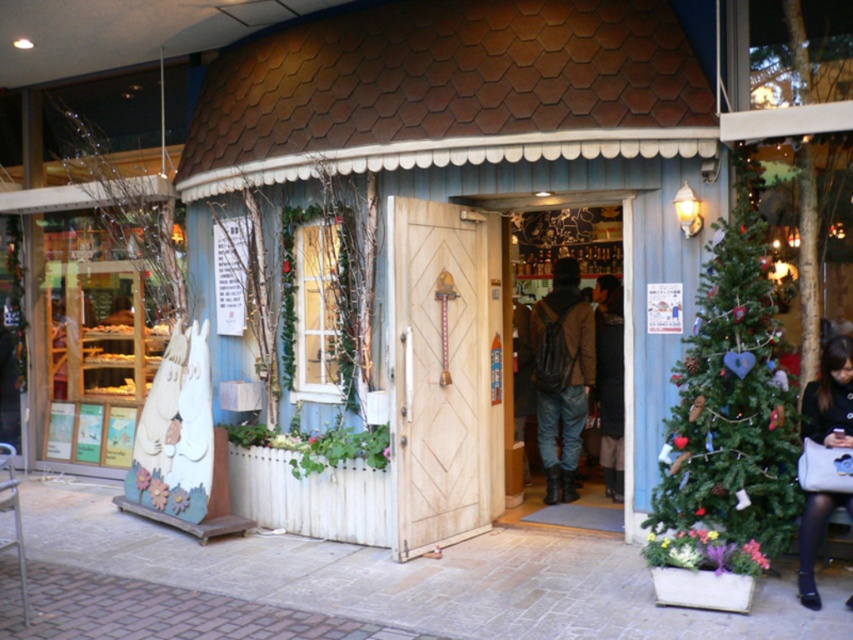
Between green matte christmas tree at right and black leather purse at lower right, which one appears on the left side from the viewer's perspective?

green matte christmas tree at right

Does green matte christmas tree at right have a smaller size compared to black leather purse at lower right?

No, green matte christmas tree at right is not smaller than black leather purse at lower right.

Where is `green matte christmas tree at right`? This screenshot has width=853, height=640. green matte christmas tree at right is located at coordinates (730, 397).

Find the location of a particular element. green matte christmas tree at right is located at coordinates (730, 397).

Is point (692, 342) positioned before point (311, 282)?

Yes, point (692, 342) is in front of point (311, 282).

Does green matte christmas tree at right appear on the right side of wooden door at center?

Yes, green matte christmas tree at right is to the right of wooden door at center.

Is point (793, 419) closer to camera compared to point (281, 314)?

Yes, it is in front of point (281, 314).

The height and width of the screenshot is (640, 853). I want to click on green matte christmas tree at right, so click(730, 397).

Is brown leather jacket at center smaller than black leather purse at lower right?

Incorrect, brown leather jacket at center is not smaller in size than black leather purse at lower right.

Identify the location of brown leather jacket at center. The image size is (853, 640). [x=561, y=376].

Which is in front, point (553, 276) or point (849, 385)?

Point (849, 385)

You are a GUI agent. You are given a task and a screenshot of the screen. Output one action in this format:
    pyautogui.click(x=<x>, y=<y>)
    Task: Click on the brown leather jacket at center
    The image size is (853, 640).
    Given the screenshot: What is the action you would take?
    pyautogui.click(x=561, y=376)